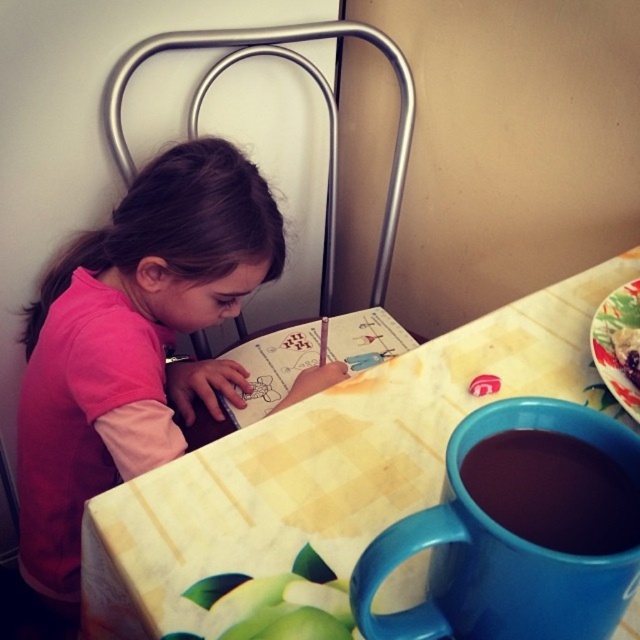
You are setting up a small snack area for the girl. The yellow printed table at center and the floral ceramic plate at upper right are both available. Which one can accommodate a larger snack item?

The yellow printed table at center might be wider than floral ceramic plate at upper right, so it can accommodate a larger snack item.